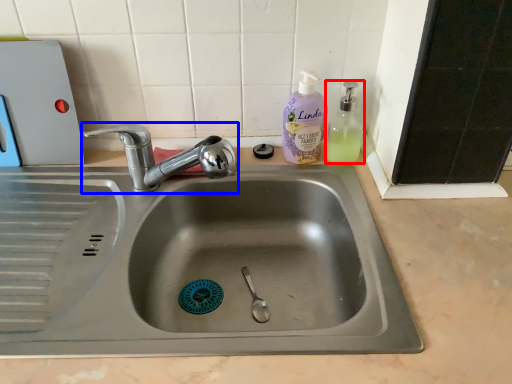
Question: Which object appears closest to the camera in this image, soap dispenser (highlighted by a red box) or tap (highlighted by a blue box)?

Choices:
 (A) soap dispenser
 (B) tap

Answer: (B)